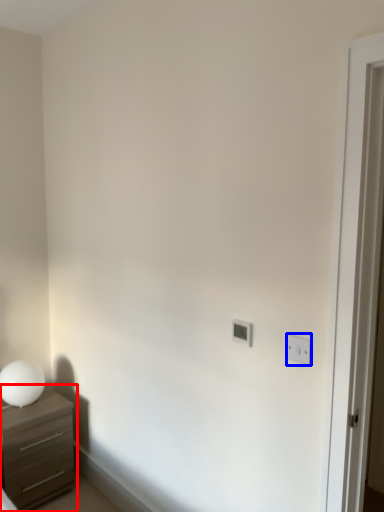
Question: Which of the following is the closest to the observer, chest of drawers (highlighted by a red box) or light switch (highlighted by a blue box)?

Choices:
 (A) chest of drawers
 (B) light switch

Answer: (B)